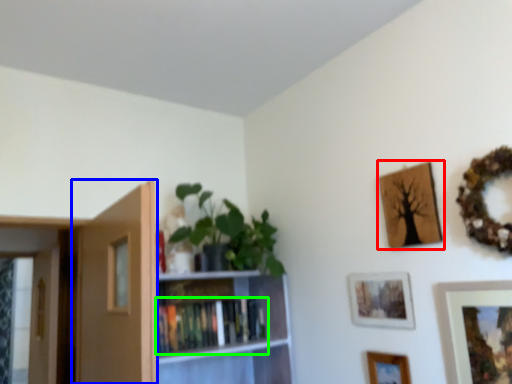
Question: Estimate the real-world distances between objects in this image. Which object is closer to picture frame (highlighted by a red box), door (highlighted by a blue box) or book (highlighted by a green box)?

Choices:
 (A) door
 (B) book

Answer: (B)